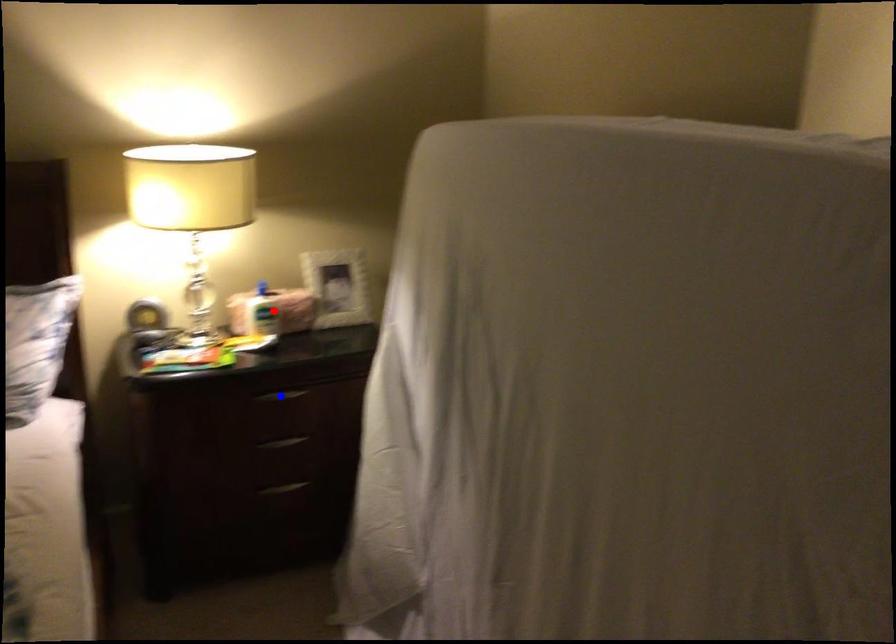
Question: Which of the two points in the image is closer to the camera?

Choices:
 (A) Blue point is closer.
 (B) Red point is closer.

Answer: (A)